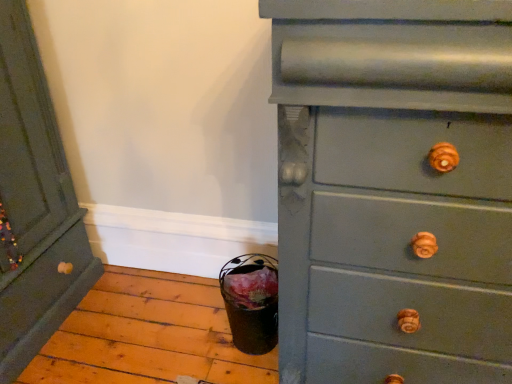
Question: Is matte green dresser at left, acting as the first chest of drawers starting from the left, inside or outside of matte gray dresser at right, the 2th chest of drawers when ordered from left to right?

Choices:
 (A) outside
 (B) inside

Answer: (A)

Question: Considering the positions of matte green dresser at left, acting as the first chest of drawers starting from the left, and matte gray dresser at right, the 2th chest of drawers when ordered from left to right, in the image, is matte green dresser at left, acting as the first chest of drawers starting from the left, wider or thinner than matte gray dresser at right, the 2th chest of drawers when ordered from left to right,?

Choices:
 (A) wide
 (B) thin

Answer: (A)

Question: From a real-world perspective, is matte green dresser at left, the second chest of drawers in the right-to-left sequence, physically located above or below matte gray dresser at right, the 1th chest of drawers positioned from the right?

Choices:
 (A) below
 (B) above

Answer: (A)

Question: Is matte gray dresser at right, the 2th chest of drawers when ordered from left to right, to the left or to the right of matte green dresser at left, acting as the first chest of drawers starting from the left, in the image?

Choices:
 (A) left
 (B) right

Answer: (B)

Question: In the image, is matte gray dresser at right, the 1th chest of drawers positioned from the right, positioned in front of or behind matte green dresser at left, the second chest of drawers in the right-to-left sequence?

Choices:
 (A) front
 (B) behind

Answer: (A)

Question: In terms of height, does matte gray dresser at right, the 1th chest of drawers positioned from the right, look taller or shorter compared to matte green dresser at left, the second chest of drawers in the right-to-left sequence?

Choices:
 (A) short
 (B) tall

Answer: (B)

Question: In terms of width, does matte gray dresser at right, the 2th chest of drawers when ordered from left to right, look wider or thinner when compared to matte green dresser at left, the second chest of drawers in the right-to-left sequence?

Choices:
 (A) thin
 (B) wide

Answer: (A)